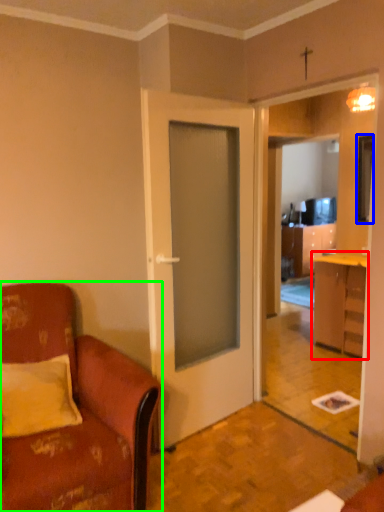
Question: Based on their relative distances, which object is nearer to cabinetry (highlighted by a red box)? Choose from television (highlighted by a blue box) and chair (highlighted by a green box).

Choices:
 (A) television
 (B) chair

Answer: (A)